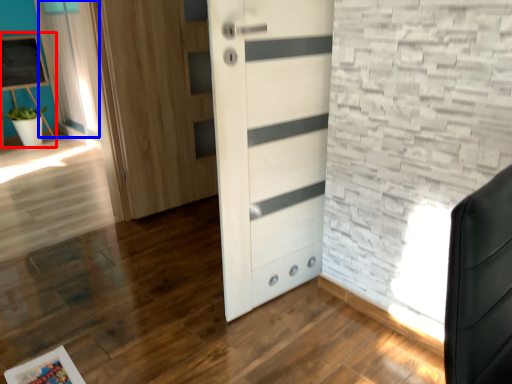
Question: Among these objects, which one is farthest to the camera, bulletin board (highlighted by a red box) or curtain (highlighted by a blue box)?

Choices:
 (A) bulletin board
 (B) curtain

Answer: (A)